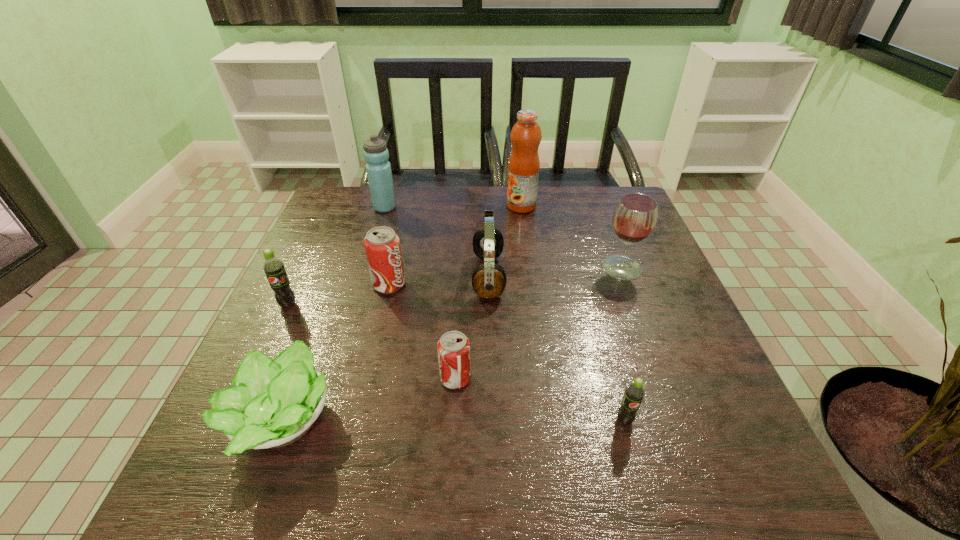
You are a GUI agent. You are given a task and a screenshot of the screen. Output one action in this format:
    pyautogui.click(x=<x>, y=<y>)
    Task: Click on the third farthest soda
    
    Given the screenshot: What is the action you would take?
    pyautogui.click(x=453, y=347)

This screenshot has height=540, width=960. What are the coordinates of `the right pink soda can` in the screenshot? It's located at (453, 347).

Image resolution: width=960 pixels, height=540 pixels. What are the coordinates of `the right green soda` in the screenshot? It's located at (634, 393).

Identify the location of the nearer green soda. (634, 393).

The image size is (960, 540). Identify the location of lettuce. (273, 403).

Where is `vacant area situated 0.100m on the front label of the third object from right to left`? The height and width of the screenshot is (540, 960). vacant area situated 0.100m on the front label of the third object from right to left is located at coordinates (473, 206).

You are a GUI agent. You are given a task and a screenshot of the screen. Output one action in this format:
    pyautogui.click(x=<x>, y=<y>)
    Task: Click on the vacant point located on the front label of the third object from right to left
    This screenshot has width=960, height=540.
    Given the screenshot: What is the action you would take?
    pyautogui.click(x=467, y=206)

Find the location of `free space located on the front label of the third object from right to left`. free space located on the front label of the third object from right to left is located at coordinates (480, 206).

The height and width of the screenshot is (540, 960). Find the location of `vacant region located 0.080m on the back of the second tallest object`. vacant region located 0.080m on the back of the second tallest object is located at coordinates (391, 188).

Identify the location of vacant space located 0.160m on the left of the rightmost object. This screenshot has height=540, width=960. (538, 268).